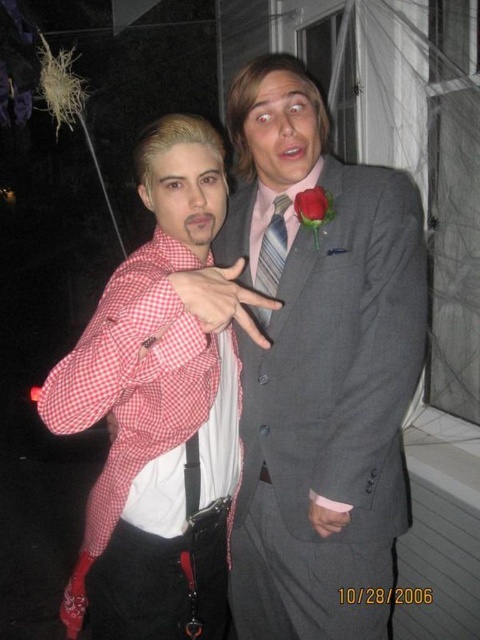
Is point (262, 257) positioned behind point (326, 220)?

Yes, it is.

Can you confirm if pink striped tie at center is positioned to the left of red velvet rose at upper center?

Indeed, pink striped tie at center is positioned on the left side of red velvet rose at upper center.

Is point (261, 282) less distant than point (308, 214)?

No, (261, 282) is behind (308, 214).

Locate an element on the screen. Image resolution: width=480 pixels, height=640 pixels. pink striped tie at center is located at coordinates [273, 250].

Which is more to the right, matte gray suit at center or pink striped tie at center?

Positioned to the right is matte gray suit at center.

Which is behind, point (360, 230) or point (264, 310)?

Point (264, 310)

Find the location of a particular element. This screenshot has width=480, height=640. matte gray suit at center is located at coordinates (321, 371).

Who is taller, matte gray suit at center or checkered fabric shirt at left?

With more height is matte gray suit at center.

Does matte gray suit at center have a lesser width compared to checkered fabric shirt at left?

Correct, matte gray suit at center's width is less than checkered fabric shirt at left's.

Describe the element at coordinates (321, 371) in the screenshot. The width and height of the screenshot is (480, 640). I see `matte gray suit at center` at that location.

At what (x,y) coordinates should I click in order to perform the action: click on matte gray suit at center. Please return your answer as a coordinate pair (x, y). The height and width of the screenshot is (640, 480). Looking at the image, I should click on (321, 371).